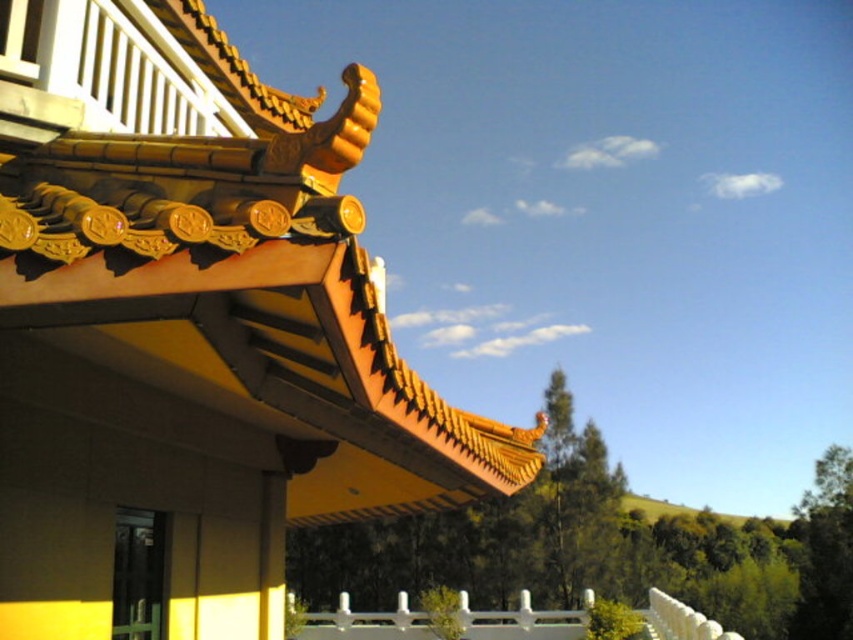
Does golden glazed tiles at upper left have a lesser width compared to white glossy fence at lower center?

Correct, golden glazed tiles at upper left's width is less than white glossy fence at lower center's.

Which is behind, point (311, 333) or point (376, 628)?

Point (376, 628)

Where is `golden glazed tiles at upper left`? The image size is (853, 640). golden glazed tiles at upper left is located at coordinates (242, 288).